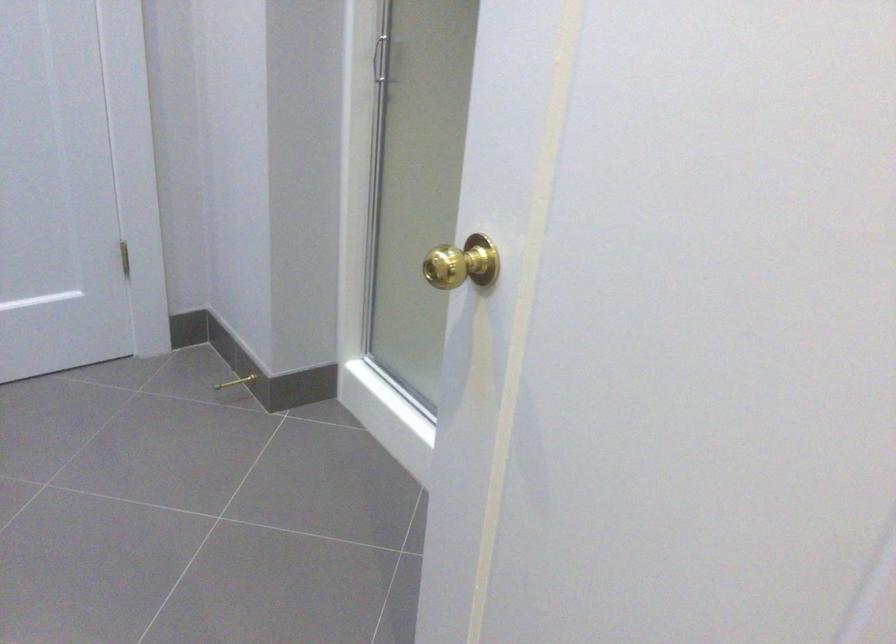
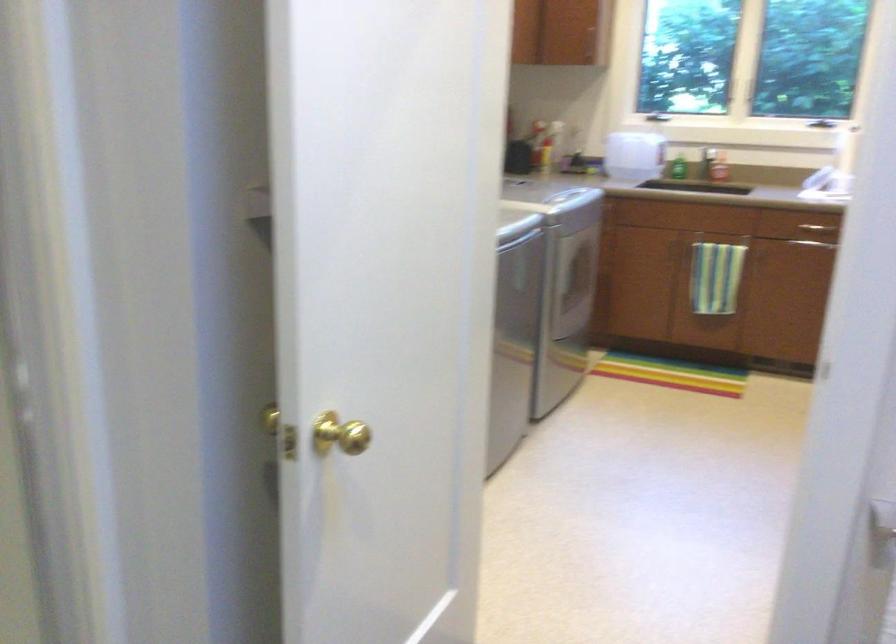
Where in the second image is the point corresponding to the point at 543,323 from the first image?

(339, 433)